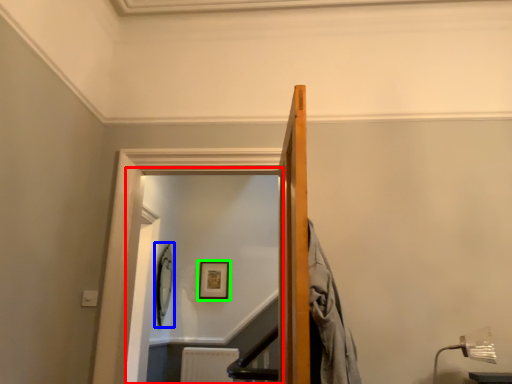
Question: Based on their relative distances, which object is nearer to glass door (highlighted by a red box)? Choose from picture frame (highlighted by a blue box) and picture frame (highlighted by a green box).

Choices:
 (A) picture frame
 (B) picture frame

Answer: (A)